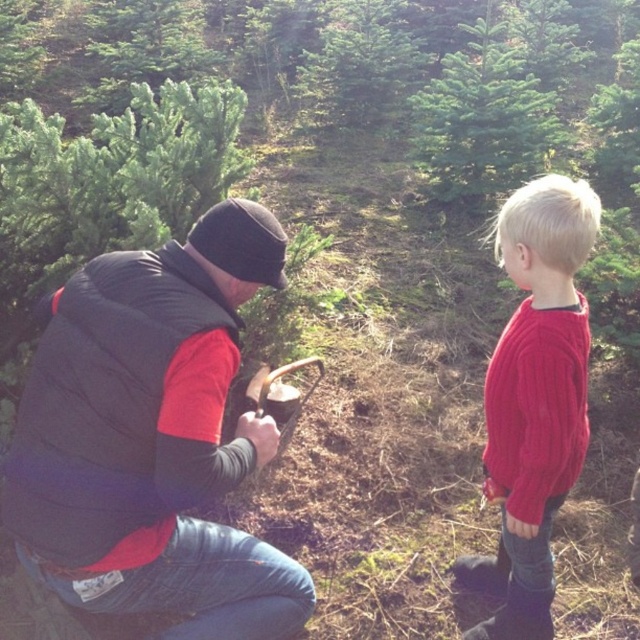
Looking at this image, does cable-knit sweater at right appear on the left side of green matte tree at upper center?

Yes, cable-knit sweater at right is to the left of green matte tree at upper center.

Does point (524, 536) come in front of point (486, 40)?

That is True.

This screenshot has width=640, height=640. I want to click on cable-knit sweater at right, so click(534, 400).

Can you confirm if matte black vest at left is wider than cable-knit sweater at right?

Yes.

Between matte black vest at left and cable-knit sweater at right, which one has more height?

With more height is cable-knit sweater at right.

What do you see at coordinates (152, 436) in the screenshot? I see `matte black vest at left` at bounding box center [152, 436].

This screenshot has height=640, width=640. I want to click on matte black vest at left, so click(152, 436).

Can you confirm if matte black vest at left is shorter than green matte tree at upper center?

Indeed, matte black vest at left has a lesser height compared to green matte tree at upper center.

Is point (248, 449) more distant than point (458, 179)?

No, it is not.

Measure the distance between matte black vest at left and camera.

A distance of 4.79 feet exists between matte black vest at left and camera.

Where is `matte black vest at left`? The height and width of the screenshot is (640, 640). matte black vest at left is located at coordinates (152, 436).